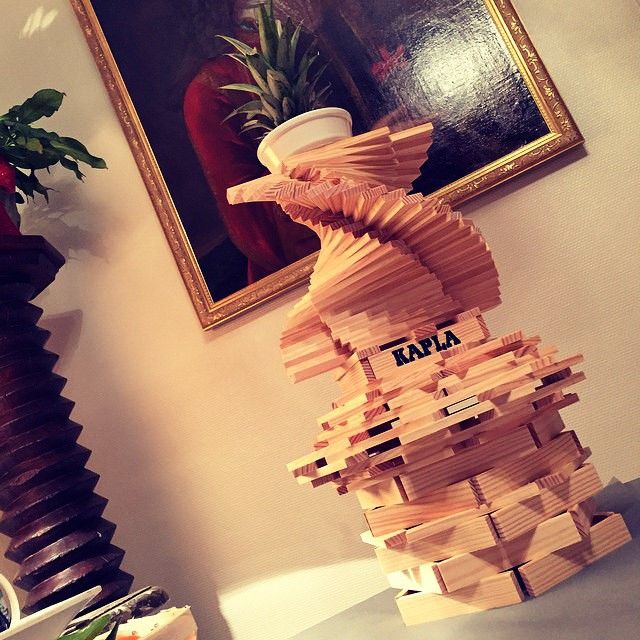
Where is `red plant pot`? This screenshot has height=640, width=640. red plant pot is located at coordinates (9, 176).